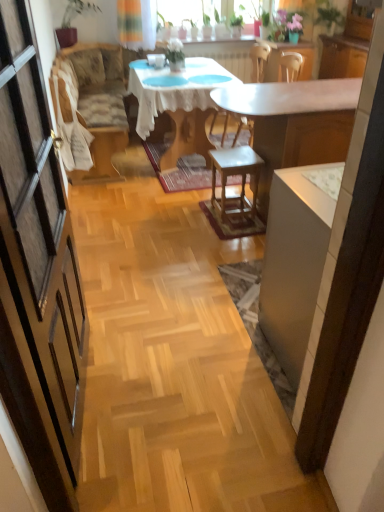
At what (x,y) coordinates should I click in order to perform the action: click on green matte plant at upper center. Please return your answer as a coordinate pair (x, y). Looking at the image, I should click on (175, 51).

What do you see at coordinates (175, 51) in the screenshot? I see `green matte plant at upper center` at bounding box center [175, 51].

The width and height of the screenshot is (384, 512). What do you see at coordinates (95, 103) in the screenshot?
I see `patterned fabric couch at left` at bounding box center [95, 103].

Identify the location of patterned fabric couch at left. This screenshot has width=384, height=512. (95, 103).

The width and height of the screenshot is (384, 512). Describe the element at coordinates (294, 123) in the screenshot. I see `white glossy desk at center` at that location.

Where is `white lace tablecloth at center`? The image size is (384, 512). white lace tablecloth at center is located at coordinates (178, 104).

Image resolution: width=384 pixels, height=512 pixels. Describe the element at coordinates (178, 104) in the screenshot. I see `white lace tablecloth at center` at that location.

Measure the distance between point (x=230, y=210) and camera.

Point (x=230, y=210) is 9.82 feet from camera.

Find the location of a particular element. The height and width of the screenshot is (512, 384). white glossy cabinet at right is located at coordinates (296, 258).

Where is `green matte plant at upper center`? This screenshot has height=512, width=384. green matte plant at upper center is located at coordinates coord(175,51).

Is white glossy cabinet at right wider than white glossy desk at center?

Incorrect, the width of white glossy cabinet at right does not surpass that of white glossy desk at center.

Looking at the image, does white glossy cabinet at right seem bigger or smaller compared to white glossy desk at center?

Clearly, white glossy cabinet at right is smaller in size than white glossy desk at center.

In the scene shown: Does white lace tablecloth at center turn towards patterned fabric couch at left?

No, white lace tablecloth at center is not facing towards patterned fabric couch at left.

In the scene shown: Is white lace tablecloth at center beside patterned fabric couch at left?

white lace tablecloth at center and patterned fabric couch at left are not in contact.

Does white lace tablecloth at center have a lesser width compared to patterned fabric couch at left?

Incorrect, the width of white lace tablecloth at center is not less than that of patterned fabric couch at left.

Between white lace tablecloth at center and patterned fabric couch at left, which one has less height?

Standing shorter between the two is white lace tablecloth at center.

Measure the distance from white glossy desk at center to patterned fabric couch at left.

1.54 meters.

Considering the relative sizes of white glossy desk at center and patterned fabric couch at left in the image provided, is white glossy desk at center taller than patterned fabric couch at left?

Incorrect, the height of white glossy desk at center is not larger of that of patterned fabric couch at left.

From the image's perspective, is white glossy desk at center above patterned fabric couch at left?

No.

Considering the sizes of objects white glossy desk at center and patterned fabric couch at left in the image provided, who is thinner, white glossy desk at center or patterned fabric couch at left?

patterned fabric couch at left is thinner.

The width and height of the screenshot is (384, 512). In order to click on plant that is on the left side of wooden stool at center in this screenshot , I will do coord(175,51).

Is green matte plant at upper center placed right next to wooden stool at center?

They are not placed beside each other.

Is green matte plant at upper center aimed at wooden stool at center?

Yes.

Which object is positioned more to the left, green matte plant at upper center or wooden stool at center?

From the viewer's perspective, green matte plant at upper center appears more on the left side.

From the image's perspective, is white glossy desk at center beneath white glossy cabinet at right?

No, from the image's perspective, white glossy desk at center is not beneath white glossy cabinet at right.

Considering the positions of point (230, 98) and point (278, 296), is point (230, 98) closer or farther from the camera than point (278, 296)?

Point (230, 98) is farther from the camera than point (278, 296).

Is white glossy desk at center positioned with its back to white glossy cabinet at right?

Yes.

Is white glossy desk at center wider than white glossy cabinet at right?

Yes, white glossy desk at center is wider than white glossy cabinet at right.

From a real-world perspective, who is located lower, white lace tablecloth at center or green matte plant at upper center?

From a 3D spatial view, white lace tablecloth at center is below.

Is white lace tablecloth at center inside the boundaries of green matte plant at upper center, or outside?

white lace tablecloth at center is not inside green matte plant at upper center, it's outside.

Considering the relative sizes of white lace tablecloth at center and green matte plant at upper center in the image provided, is white lace tablecloth at center wider than green matte plant at upper center?

Yes.

From a real-world perspective, who is located higher, green matte plant at upper center or white glossy desk at center?

In real-world perspective, green matte plant at upper center is above.

Image resolution: width=384 pixels, height=512 pixels. In order to click on plant that appears above the white glossy desk at center (from a real-world perspective) in this screenshot , I will do `click(175, 51)`.

Is green matte plant at upper center oriented towards white glossy desk at center?

No, green matte plant at upper center does not turn towards white glossy desk at center.

Can you confirm if green matte plant at upper center is wider than white glossy desk at center?

No.

Find the location of a particular element. This screenshot has width=384, height=512. desk on the right of white glossy cabinet at right is located at coordinates (294, 123).

The width and height of the screenshot is (384, 512). I want to click on kitchen & dining room table above the patterned fabric couch at left (from a real-world perspective), so click(178, 104).

Looking at this image, based on their spatial positions, is white lace tablecloth at center or white glossy cabinet at right closer to patterned fabric couch at left?

white lace tablecloth at center is closer to patterned fabric couch at left.

Looking at the image, which one is located further to green matte plant at upper center, white lace tablecloth at center or wooden stool at center?

wooden stool at center is further to green matte plant at upper center.

Looking at the image, which one is located closer to wooden stool at center, white glossy desk at center or patterned fabric couch at left?

Based on the image, white glossy desk at center appears to be nearer to wooden stool at center.

Consider the image. From the image, which object appears to be nearer to white glossy desk at center, white lace tablecloth at center or white glossy cabinet at right?

white lace tablecloth at center lies closer to white glossy desk at center than the other object.

When comparing their distances from green matte plant at upper center, does white glossy desk at center or wooden stool at center seem closer?

white glossy desk at center.

Based on their spatial positions, is white lace tablecloth at center or white glossy desk at center closer to wooden stool at center?

white glossy desk at center lies closer to wooden stool at center than the other object.

From the image, which object appears to be farther from patterned fabric couch at left, white glossy cabinet at right or wooden stool at center?

Based on the image, white glossy cabinet at right appears to be further to patterned fabric couch at left.

Which object lies nearer to the anchor point green matte plant at upper center, white glossy cabinet at right or white lace tablecloth at center?

white lace tablecloth at center lies closer to green matte plant at upper center than the other object.

At what (x,y) coordinates should I click in order to perform the action: click on desk located between white glossy cabinet at right and white lace tablecloth at center in the depth direction. Please return your answer as a coordinate pair (x, y). Looking at the image, I should click on (294, 123).

Identify the location of kitchen & dining room table between patterned fabric couch at left and wooden stool at center in the horizontal direction. (178, 104).

Find the location of a particular element. The height and width of the screenshot is (512, 384). stool located between patterned fabric couch at left and white glossy desk at center in the left-right direction is located at coordinates (242, 182).

You are a GUI agent. You are given a task and a screenshot of the screen. Output one action in this format:
    pyautogui.click(x=<x>, y=<y>)
    Task: Click on the kitchen & dining room table located between white glossy desk at center and green matte plant at upper center in the depth direction
    
    Given the screenshot: What is the action you would take?
    pyautogui.click(x=178, y=104)